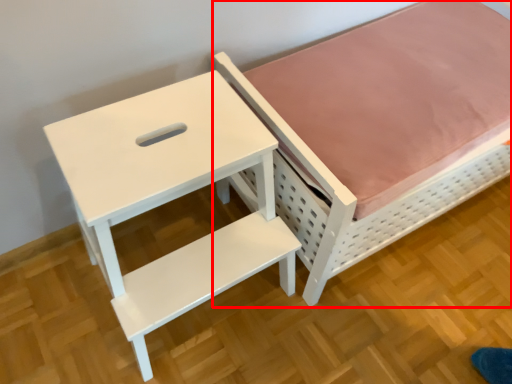
Question: In this image, where is furniture (annotated by the red box) located relative to table?

Choices:
 (A) right
 (B) left

Answer: (A)